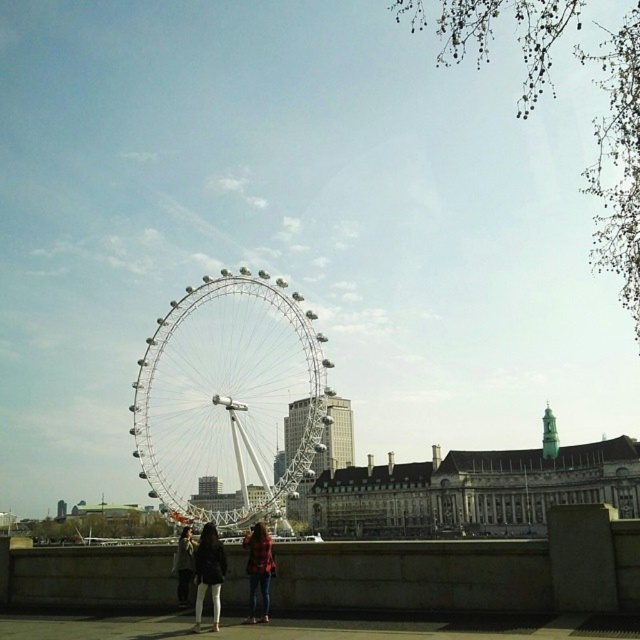
You are a photographer trying to capture a photo of the London Eye from your current position. You notice two people nearby wearing a black leather jacket at lower center and a flannel shirt at center. Which person is closer to the ground?

The black leather jacket at lower center is below flannel shirt at center, so the person wearing the black leather jacket at lower center is closer to the ground.

You are standing at the point marked by the coordinates point (209, 573) in the scene. What is the nearest object to you?

The nearest object to you at point (209, 573) is the matte black jacket at lower center.

Looking at this image, you are standing at the scene and want to determine which jacket is bigger between the matte black jacket at lower center and the black leather jacket at lower center. Based on their positions, can you tell which one is larger?

The matte black jacket at lower center has a larger size compared to the black leather jacket at lower center, so the matte black jacket at lower center is bigger.